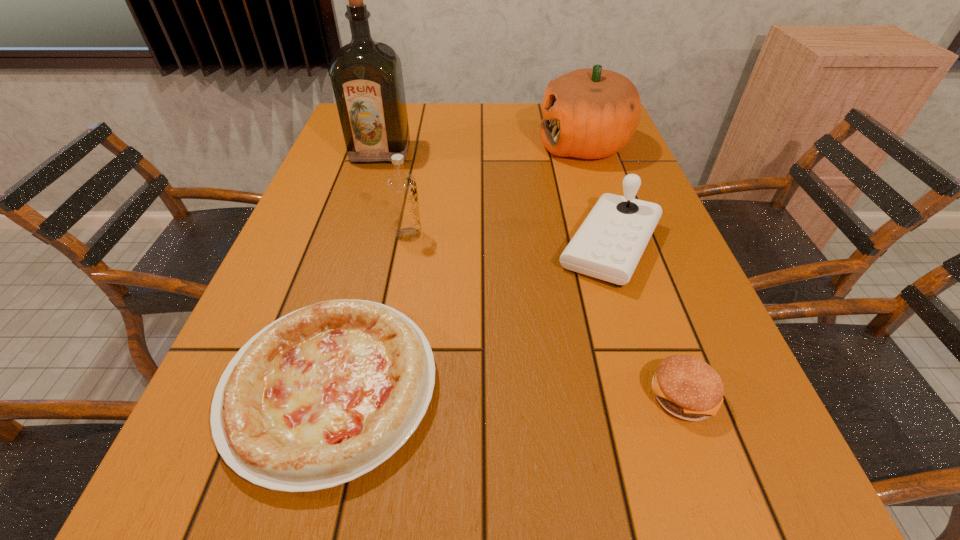
The image size is (960, 540). In order to click on vacant space located on the front label of the vodka in this screenshot , I will do `click(544, 235)`.

Where is `vacant space positioned on the left of the third shortest object`? The height and width of the screenshot is (540, 960). vacant space positioned on the left of the third shortest object is located at coordinates [x=450, y=246].

Where is `blank space located 0.150m on the left of the hamburger`? blank space located 0.150m on the left of the hamburger is located at coordinates (561, 395).

I want to click on free location located on the right of the pizza, so click(598, 387).

Identify the location of object that is at the far edge. The image size is (960, 540). (591, 113).

Locate an element on the screen. object located in the near edge section of the desktop is located at coordinates (323, 395).

Where is `liquor positioned at the left edge`? liquor positioned at the left edge is located at coordinates (366, 76).

Where is `pizza that is at the left edge`? The image size is (960, 540). pizza that is at the left edge is located at coordinates (323, 395).

Locate an element on the screen. pumpkin that is at the right edge is located at coordinates (591, 113).

Identify the location of joystick that is positioned at the right edge. (608, 245).